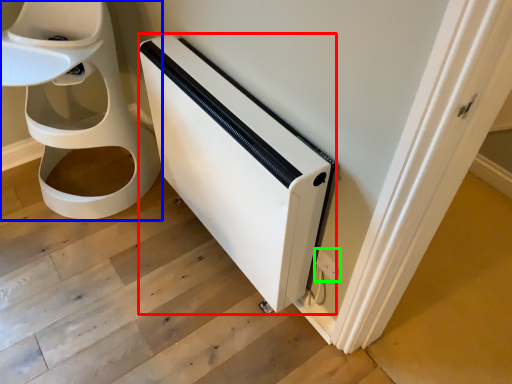
Question: Based on their relative distances, which object is nearer to appliance (highlighted by a red box)? Choose from toilet (highlighted by a blue box) and electric outlet (highlighted by a green box).

Choices:
 (A) toilet
 (B) electric outlet

Answer: (B)